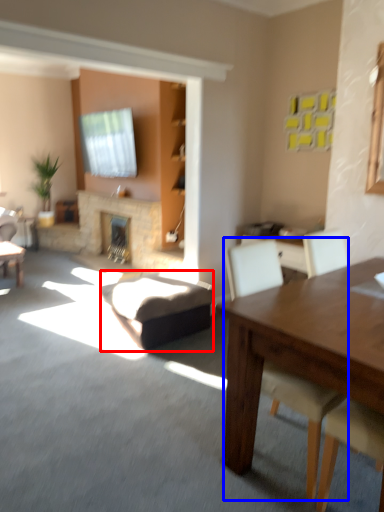
Question: Which object is closer to the camera taking this photo, swivel chair (highlighted by a red box) or chair (highlighted by a blue box)?

Choices:
 (A) swivel chair
 (B) chair

Answer: (B)